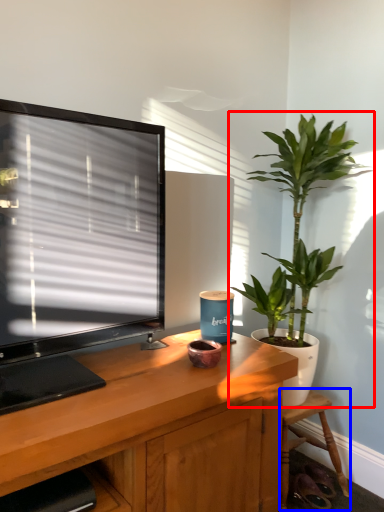
Question: Which object appears closest to the camera in this image, houseplant (highlighted by a red box) or chair (highlighted by a blue box)?

Choices:
 (A) houseplant
 (B) chair

Answer: (A)